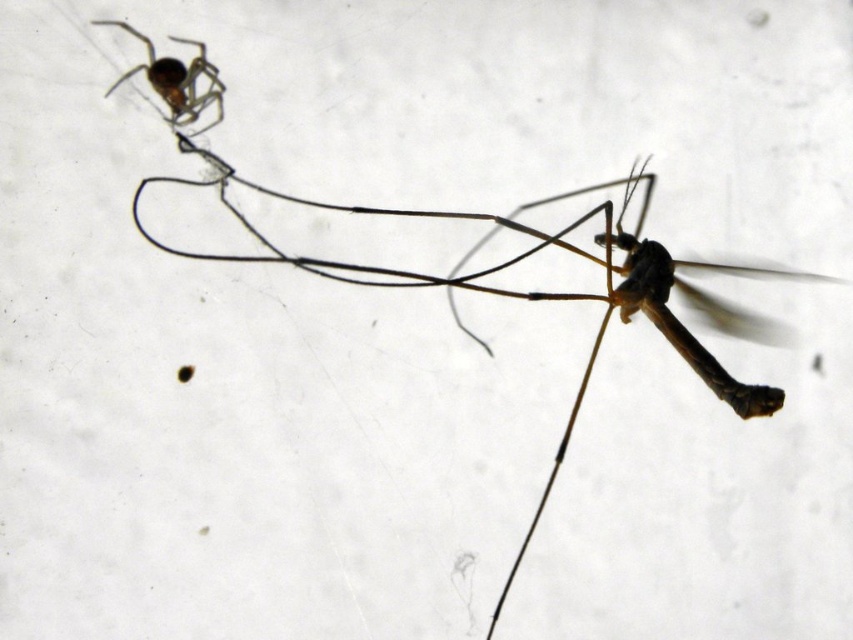
You are a photographer adjusting the focus on your camera. You have two points in your viewfinder, point 1 at point 1 at point (582,380) and point 2 at point (178,112). If you want to focus on the closer point to the camera, which point should you choose?

Point (178,112) is closer to the camera than point (582,380), so you should focus on point (178,112).

You are a scientist measuring the distance between two spiders in the image. The spiders are the matte black spider at upper left and the shiny brown spider at upper left. According to your measurements, how far apart are they?

The matte black spider at upper left and the shiny brown spider at upper left are 39.09 centimeters apart.

You are standing 5 feet away from the image. There is a point at coordinates point (715,387). Can you reach this point with your hand without moving closer to the image?

The distance of point (715,387) from viewer is 4.74 feet, so yes, you can reach it with your hand since you are standing 5 feet away, which is slightly farther than the point.